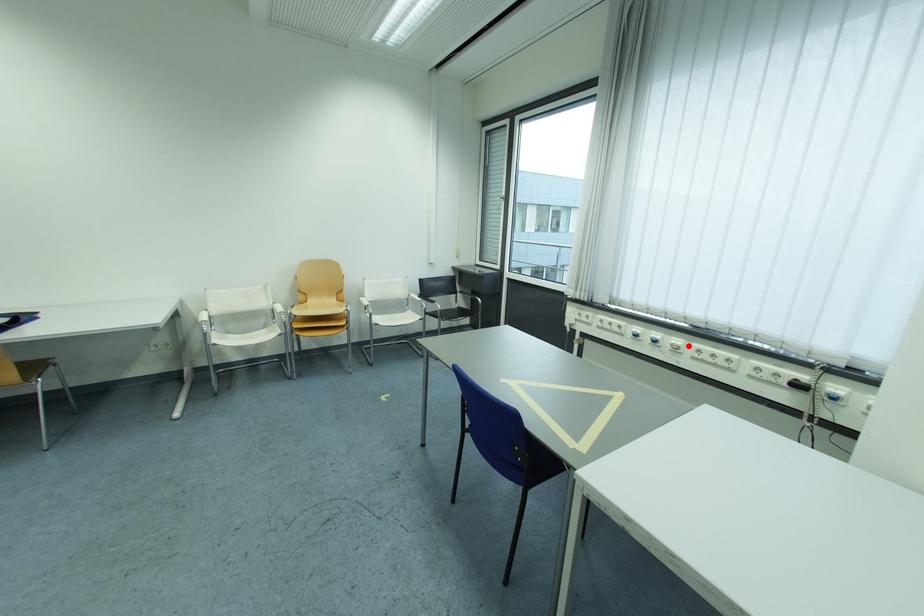
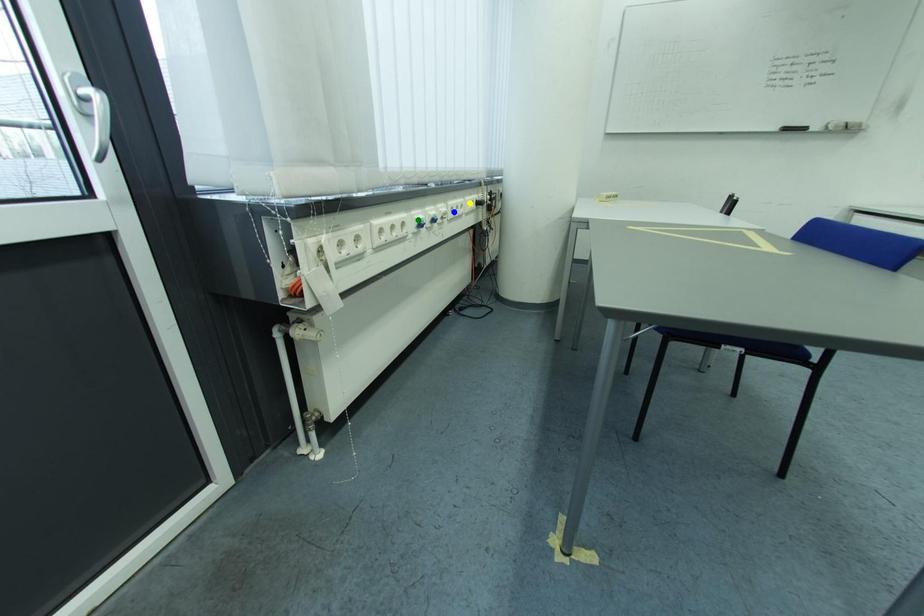
Question: I am providing you with two images of the same scene from different viewpoints. A red point is marked on the first image. You are given multiple points on the second image. Which point in image 2 is actually the same real-world point as the red point in image 1?

Choices:
 (A) green point
 (B) blue point
 (C) yellow point

Answer: (B)